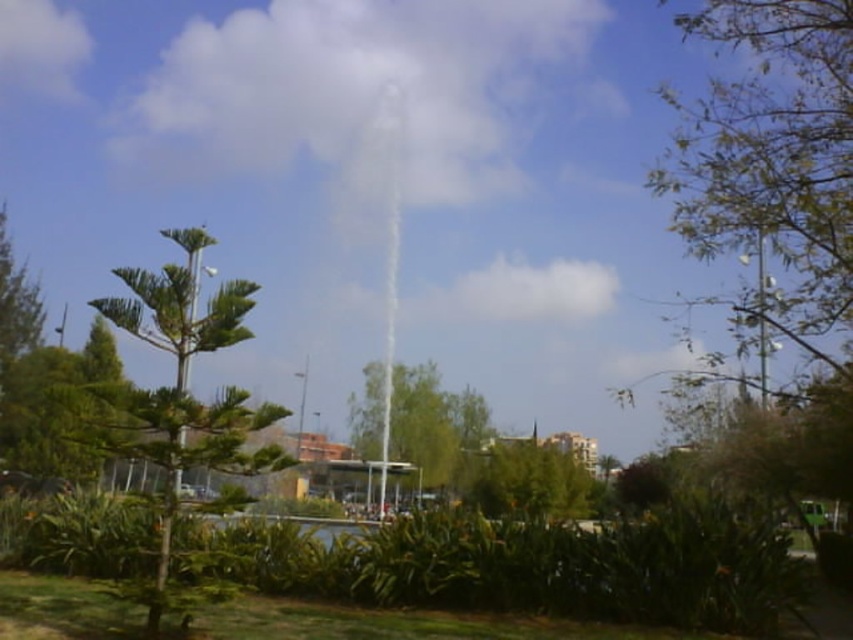
You are standing in the park and want to take a photo of the fountain. You notice two green leafy trees in the scene. Which tree, the green leafy tree at right or the green leafy tree at center, is closer to you?

The green leafy tree at right is closer to you because it is positioned in front of the green leafy tree at center.

You are standing in the park and want to take a photo of both the green leafy tree at left and the green leafy tree at center. Which tree should you position yourself closer to in order to capture both in the same frame?

To capture both the green leafy tree at left and the green leafy tree at center in the same frame, you should position yourself closer to the green leafy tree at left since it is positioned to the left of the green leafy tree at center, allowing for a wider angle to include both trees in the shot.